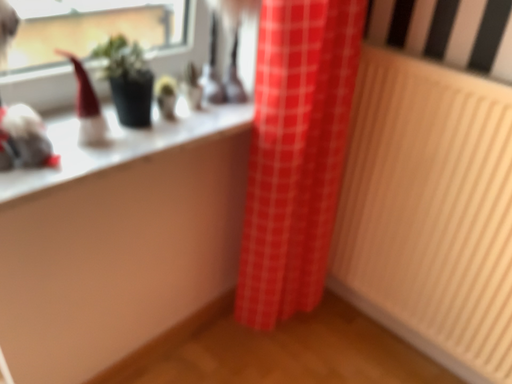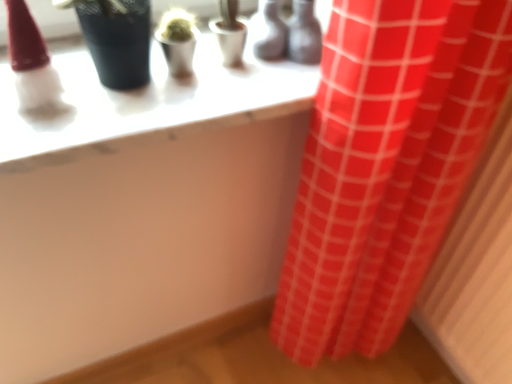
Question: How did the camera likely rotate when shooting the video?

Choices:
 (A) rotated downward
 (B) rotated upward

Answer: (A)